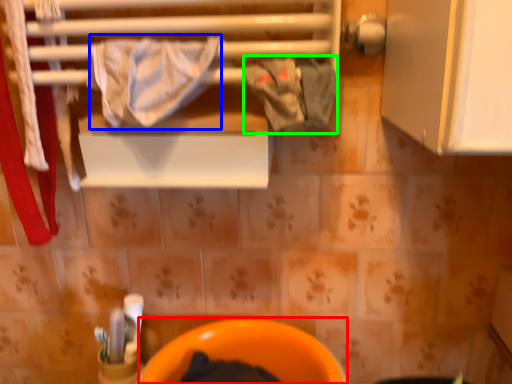
Question: Estimate the real-world distances between objects in this image. Which object is farther from toilet bowl (highlighted by a red box), bath towel (highlighted by a blue box) or clothing (highlighted by a green box)?

Choices:
 (A) bath towel
 (B) clothing

Answer: (A)